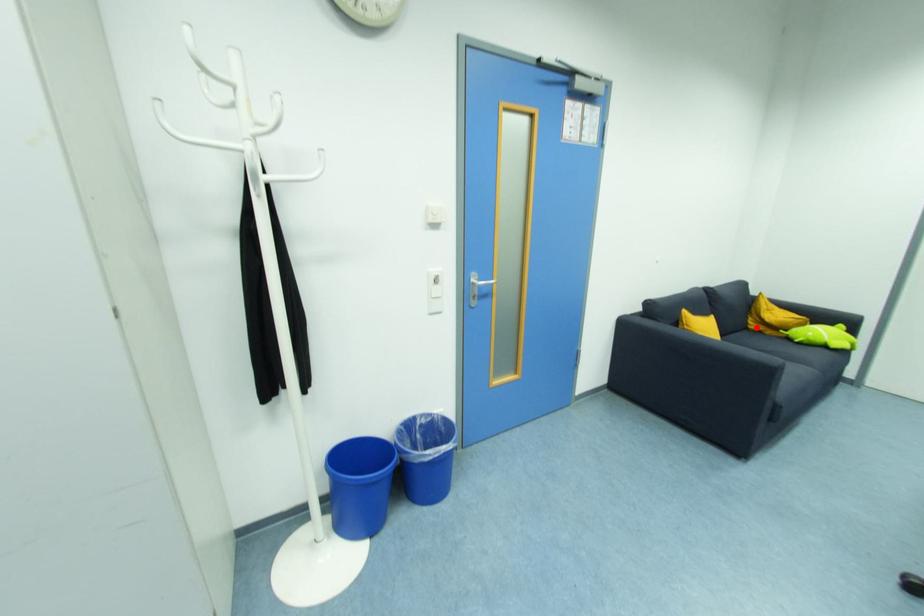
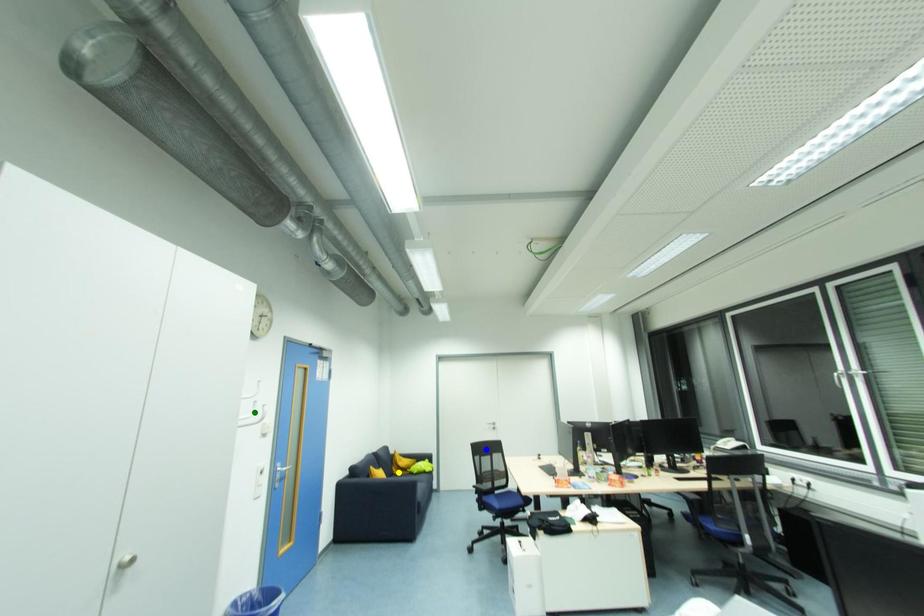
Question: I am providing you with two images of the same scene from different viewpoints. A red point is marked on the first image. You are given multiple points on the second image. Can you choose the point in image 2 that corresponds to the point in image 1?

Choices:
 (A) blue point
 (B) green point
 (C) yellow point

Answer: (C)